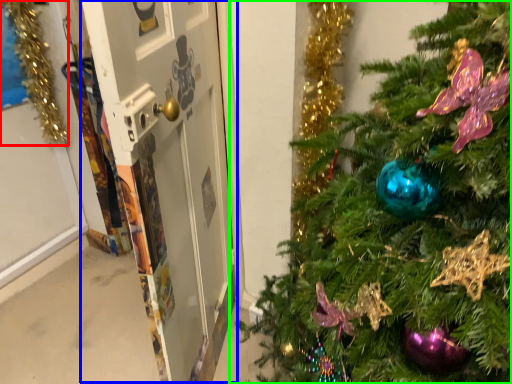
Question: Considering the real-world distances, which object is farthest from christmas decoration (highlighted by a red box)? screen door (highlighted by a blue box) or christmas tree (highlighted by a green box)?

Choices:
 (A) screen door
 (B) christmas tree

Answer: (B)